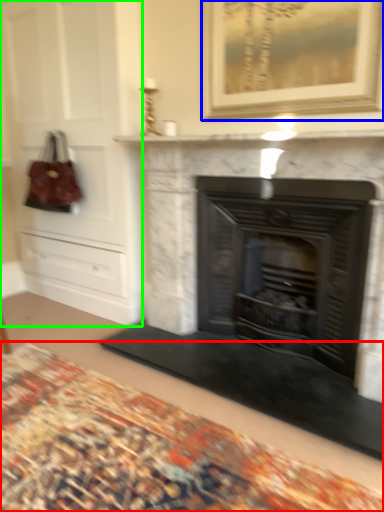
Question: Considering the real-world distances, which object is closest to plain (highlighted by a red box)? picture frame (highlighted by a blue box) or dresser (highlighted by a green box).

Choices:
 (A) picture frame
 (B) dresser

Answer: (B)